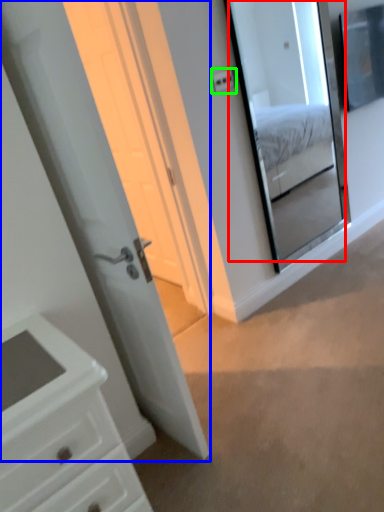
Question: Considering the real-world distances, which object is closest to mirror (highlighted by a red box)? door (highlighted by a blue box) or light switch (highlighted by a green box).

Choices:
 (A) door
 (B) light switch

Answer: (B)